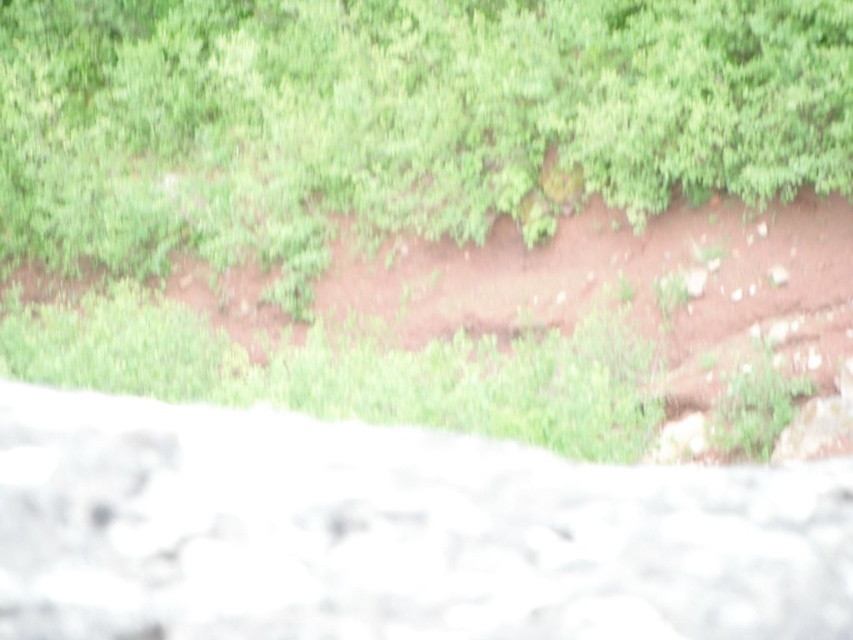
You are a hiker trying to navigate through the rocky path. You see a white marble stone at center and a brown dirt track at center. Which one is closer to you?

The white marble stone at center is closer to the viewer than the brown dirt track at center.

You are standing at the point marked as point (392, 532) on a map of the hillside. According to the image, what type of surface are you currently standing on?

The point (392, 532) is on white marble stone at center, so you are standing on white marble stone.